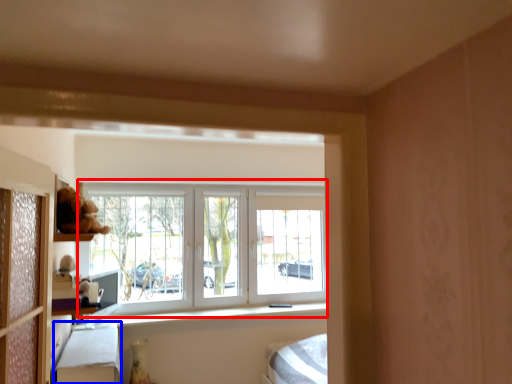
Question: Which of the following is the closest to the observer, window (highlighted by a red box) or bed frame (highlighted by a blue box)?

Choices:
 (A) window
 (B) bed frame

Answer: (B)